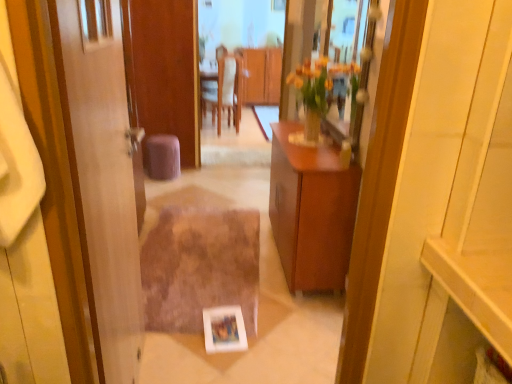
Question: Is wooden door at left looking in the opposite direction of clear glass mirror at upper center, placed as the 1th mirror when sorted from front to back?

Choices:
 (A) yes
 (B) no

Answer: (B)

Question: Is wooden door at left smaller than clear glass mirror at upper center, placed as the 1th mirror when sorted from front to back?

Choices:
 (A) yes
 (B) no

Answer: (B)

Question: Is clear glass mirror at upper center, the first mirror positioned from the right, completely or partially inside wooden door at left?

Choices:
 (A) yes
 (B) no

Answer: (B)

Question: Can you confirm if wooden door at left is wider than clear glass mirror at upper center, placed as the 1th mirror when sorted from front to back?

Choices:
 (A) no
 (B) yes

Answer: (B)

Question: Would you say wooden door at left is a long distance from clear glass mirror at upper center, which is the 2th mirror from back to front?

Choices:
 (A) yes
 (B) no

Answer: (A)

Question: Is wooden door at left in contact with clear glass mirror at upper center, which is the 2th mirror from back to front?

Choices:
 (A) no
 (B) yes

Answer: (A)

Question: Is the depth of brown shaggy rug at center greater than that of clear glass mirror at upper center, placed as the 1th mirror when sorted from front to back?

Choices:
 (A) yes
 (B) no

Answer: (A)

Question: From a real-world perspective, is brown shaggy rug at center physically below clear glass mirror at upper center, which is the 2th mirror from back to front?

Choices:
 (A) yes
 (B) no

Answer: (A)

Question: Is brown shaggy rug at center oriented away from clear glass mirror at upper center, which is the 2th mirror from back to front?

Choices:
 (A) yes
 (B) no

Answer: (B)

Question: Is brown shaggy rug at center bigger than clear glass mirror at upper center, placed as the second mirror when sorted from left to right?

Choices:
 (A) no
 (B) yes

Answer: (B)

Question: Are brown shaggy rug at center and clear glass mirror at upper center, placed as the second mirror when sorted from left to right, beside each other?

Choices:
 (A) no
 (B) yes

Answer: (A)

Question: From the image's perspective, is brown shaggy rug at center beneath clear glass mirror at upper center, the first mirror positioned from the right?

Choices:
 (A) no
 (B) yes

Answer: (B)

Question: Is the position of wooden table at center, which is the 1th mirror in back-to-front order, more distant than that of wooden cabinet at center, which ranks as the 2th cabinetry in top-to-bottom order?

Choices:
 (A) yes
 (B) no

Answer: (A)